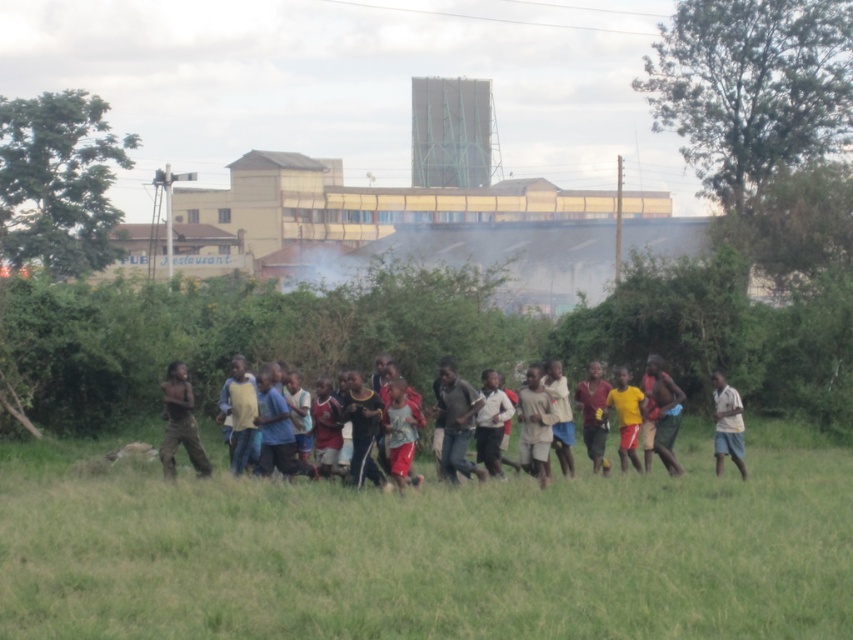
Question: Does multicolored clothing at center have a larger size compared to dark brown pants at left?

Choices:
 (A) no
 (B) yes

Answer: (A)

Question: Which object is closer to the camera taking this photo?

Choices:
 (A) green grass at center
 (B) dark brown pants at left

Answer: (A)

Question: Which object is closer to the camera taking this photo?

Choices:
 (A) white cotton shirt at right
 (B) green grass at center
 (C) multicolored clothing at center

Answer: (B)

Question: Is green grass at center thinner than dark brown pants at left?

Choices:
 (A) no
 (B) yes

Answer: (A)

Question: Can you confirm if green grass at center is positioned to the right of yellow matte shirt at center?

Choices:
 (A) yes
 (B) no

Answer: (B)

Question: Considering the real-world distances, which object is farthest from the yellow matte shirt at center?

Choices:
 (A) multicolored clothing at center
 (B) white cotton shirt at right
 (C) dark brown pants at left

Answer: (C)